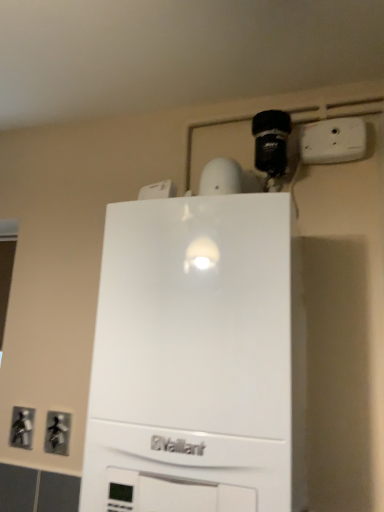
This screenshot has height=512, width=384. Describe the element at coordinates (22, 426) in the screenshot. I see `metallic silver outlet at lower left, the 3th electric outlet from the top` at that location.

Find the location of `metallic gray outlet at lower left, which appears as the 2th electric outlet when viewed from the front`. metallic gray outlet at lower left, which appears as the 2th electric outlet when viewed from the front is located at coordinates (57, 433).

From a real-world perspective, who is located higher, white matte vaillant boiler at center or metallic gray outlet at lower left, which is counted as the second electric outlet, starting from the top?

In real-world perspective, white matte vaillant boiler at center is above.

At what (x,y) coordinates should I click in order to perform the action: click on the 2nd electric outlet behind the white matte vaillant boiler at center, counting from the anchor's position. Please return your answer as a coordinate pair (x, y). Looking at the image, I should click on (57, 433).

Choose the correct answer: Is white matte vaillant boiler at center inside metallic gray outlet at lower left, which is counted as the second electric outlet, starting from the top, or outside it?

white matte vaillant boiler at center is located beyond the bounds of metallic gray outlet at lower left, which is counted as the second electric outlet, starting from the top.

From the image's perspective, does white matte vaillant boiler at center appear lower than metallic gray outlet at lower left, which is counted as the second electric outlet, starting from the top?

Incorrect, from the image's perspective, white matte vaillant boiler at center is higher than metallic gray outlet at lower left, which is counted as the second electric outlet, starting from the top.

Would you say metallic silver outlet at lower left, the 3th electric outlet from the right, is a long distance from metallic gray outlet at lower left, acting as the second electric outlet starting from the left?

No, there isn't a large distance between metallic silver outlet at lower left, the 3th electric outlet from the right, and metallic gray outlet at lower left, acting as the second electric outlet starting from the left.

Considering the sizes of metallic silver outlet at lower left, the 3th electric outlet from the right, and metallic gray outlet at lower left, which appears as the 2th electric outlet when viewed from the front, in the image, is metallic silver outlet at lower left, the 3th electric outlet from the right, taller or shorter than metallic gray outlet at lower left, which appears as the 2th electric outlet when viewed from the front,?

Clearly, metallic silver outlet at lower left, the 3th electric outlet from the right, is taller compared to metallic gray outlet at lower left, which appears as the 2th electric outlet when viewed from the front.

Is metallic silver outlet at lower left, the third electric outlet in the front-to-back sequence, positioned before metallic gray outlet at lower left, acting as the second electric outlet starting from the left?

No, it is behind metallic gray outlet at lower left, acting as the second electric outlet starting from the left.

From a real-world perspective, which is physically above, metallic silver outlet at lower left, which is counted as the 1th electric outlet, starting from the bottom, or metallic gray outlet at lower left, arranged as the second electric outlet when ordered from the bottom?

metallic silver outlet at lower left, which is counted as the 1th electric outlet, starting from the bottom, from a real-world perspective.

Does white plastic electric outlet at upper center, arranged as the 1th electric outlet when viewed from the top, have a lesser width compared to metallic gray outlet at lower left, acting as the second electric outlet starting from the left?

In fact, white plastic electric outlet at upper center, arranged as the 1th electric outlet when viewed from the top, might be wider than metallic gray outlet at lower left, acting as the second electric outlet starting from the left.

Is white plastic electric outlet at upper center, the 1th electric outlet positioned from the right, smaller than metallic gray outlet at lower left, marked as the 2th electric outlet in a back-to-front arrangement?

No, white plastic electric outlet at upper center, the 1th electric outlet positioned from the right, is not smaller than metallic gray outlet at lower left, marked as the 2th electric outlet in a back-to-front arrangement.

Considering the positions of point (354, 138) and point (50, 445), is point (354, 138) closer or farther from the camera than point (50, 445)?

Point (354, 138) appears to be closer to the viewer than point (50, 445).

Relative to metallic gray outlet at lower left, which is counted as the second electric outlet, starting from the right, is white plastic electric outlet at upper center, which is counted as the 3th electric outlet, starting from the back, in front or behind?

white plastic electric outlet at upper center, which is counted as the 3th electric outlet, starting from the back, is positioned closer to the viewer than metallic gray outlet at lower left, which is counted as the second electric outlet, starting from the right.

Relative to white plastic electric outlet at upper center, the third electric outlet when ordered from left to right, is metallic silver outlet at lower left, positioned as the first electric outlet in left-to-right order, in front or behind?

Visually, metallic silver outlet at lower left, positioned as the first electric outlet in left-to-right order, is located behind white plastic electric outlet at upper center, the third electric outlet when ordered from left to right.

From the metallic silver outlet at lower left, the 3th electric outlet from the right, count 2nd electric outlet to the right and point to it. Please provide its 2D coordinates.

[(333, 141)]

From the image's perspective, between metallic silver outlet at lower left, the 3th electric outlet from the right, and white plastic electric outlet at upper center, arranged as the 1th electric outlet when viewed from the top, who is located below?

metallic silver outlet at lower left, the 3th electric outlet from the right, from the image's perspective.

Are metallic silver outlet at lower left, the 3th electric outlet from the right, and white plastic electric outlet at upper center, which ranks as the third electric outlet in bottom-to-top order, located far from each other?

Yes.

Is metallic gray outlet at lower left, which is counted as the second electric outlet, starting from the top, far away from white plastic electric outlet at upper center, the 1th electric outlet positioned from the right?

Yes.

In the scene shown: Who is bigger, metallic gray outlet at lower left, marked as the 2th electric outlet in a back-to-front arrangement, or white plastic electric outlet at upper center, the third electric outlet when ordered from left to right?

Bigger between the two is white plastic electric outlet at upper center, the third electric outlet when ordered from left to right.

Considering the sizes of metallic gray outlet at lower left, arranged as the second electric outlet when ordered from the bottom, and white plastic electric outlet at upper center, the third electric outlet when ordered from left to right, in the image, is metallic gray outlet at lower left, arranged as the second electric outlet when ordered from the bottom, taller or shorter than white plastic electric outlet at upper center, the third electric outlet when ordered from left to right,?

In the image, metallic gray outlet at lower left, arranged as the second electric outlet when ordered from the bottom, appears to be taller than white plastic electric outlet at upper center, the third electric outlet when ordered from left to right.

Image resolution: width=384 pixels, height=512 pixels. What are the coordinates of `the 2nd electric outlet positioned below the white plastic electric outlet at upper center, arranged as the 1th electric outlet when viewed from the top (from a real-world perspective)` in the screenshot? It's located at pos(57,433).

In terms of width, does white plastic electric outlet at upper center, which is counted as the 3th electric outlet, starting from the back, look wider or thinner when compared to metallic silver outlet at lower left, the 3th electric outlet from the top?

white plastic electric outlet at upper center, which is counted as the 3th electric outlet, starting from the back, is wider than metallic silver outlet at lower left, the 3th electric outlet from the top.

From a real-world perspective, is white plastic electric outlet at upper center, which is counted as the 3th electric outlet, starting from the back, physically located above or below metallic silver outlet at lower left, the third electric outlet in the front-to-back sequence?

Clearly, from a real-world perspective, white plastic electric outlet at upper center, which is counted as the 3th electric outlet, starting from the back, is above metallic silver outlet at lower left, the third electric outlet in the front-to-back sequence.

Does point (364, 146) appear closer or farther from the camera than point (24, 446)?

Point (364, 146) is closer to the camera than point (24, 446).

Is white plastic electric outlet at upper center, the 1th electric outlet positioned from the right, spatially inside metallic silver outlet at lower left, the third electric outlet in the front-to-back sequence, or outside of it?

white plastic electric outlet at upper center, the 1th electric outlet positioned from the right, is spatially situated outside metallic silver outlet at lower left, the third electric outlet in the front-to-back sequence.

Can we say white matte vaillant boiler at center lies outside metallic silver outlet at lower left, acting as the 1th electric outlet starting from the back?

Absolutely, white matte vaillant boiler at center is external to metallic silver outlet at lower left, acting as the 1th electric outlet starting from the back.

From a real-world perspective, is white matte vaillant boiler at center positioned under metallic silver outlet at lower left, the 3th electric outlet from the right, based on gravity?

No, from a real-world perspective, white matte vaillant boiler at center is not beneath metallic silver outlet at lower left, the 3th electric outlet from the right.

Measure the distance between white matte vaillant boiler at center and metallic silver outlet at lower left, which is counted as the 1th electric outlet, starting from the bottom.

The distance of white matte vaillant boiler at center from metallic silver outlet at lower left, which is counted as the 1th electric outlet, starting from the bottom, is 71.09 centimeters.

At what (x,y) coordinates should I click in order to perform the action: click on the 3rd electric outlet behind when counting from the white matte vaillant boiler at center. Please return your answer as a coordinate pair (x, y). The image size is (384, 512). Looking at the image, I should click on (22, 426).

Find the location of a particular element. The height and width of the screenshot is (512, 384). the 2nd electric outlet directly beneath the white matte vaillant boiler at center (from a real-world perspective) is located at coordinates (57, 433).

Starting from the metallic silver outlet at lower left, the 3th electric outlet from the right, which electric outlet is the 1st one in front? Please provide its 2D coordinates.

[(57, 433)]

Estimate the real-world distances between objects in this image. Which object is closer to white plastic electric outlet at upper center, arranged as the 1th electric outlet when viewed from the top, metallic gray outlet at lower left, which is counted as the second electric outlet, starting from the right, or white matte vaillant boiler at center?

Among the two, white matte vaillant boiler at center is located nearer to white plastic electric outlet at upper center, arranged as the 1th electric outlet when viewed from the top.

Estimate the real-world distances between objects in this image. Which object is further from metallic silver outlet at lower left, the 3th electric outlet from the right, white plastic electric outlet at upper center, which ranks as the third electric outlet in bottom-to-top order, or white matte vaillant boiler at center?

white plastic electric outlet at upper center, which ranks as the third electric outlet in bottom-to-top order.

Considering their positions, is white plastic electric outlet at upper center, arranged as the 1th electric outlet when viewed from the top, positioned closer to metallic silver outlet at lower left, which is counted as the 1th electric outlet, starting from the bottom, than metallic gray outlet at lower left, marked as the 2th electric outlet in a back-to-front arrangement?

metallic gray outlet at lower left, marked as the 2th electric outlet in a back-to-front arrangement, is positioned closer to the anchor metallic silver outlet at lower left, which is counted as the 1th electric outlet, starting from the bottom.

Which object lies nearer to the anchor point white matte vaillant boiler at center, metallic silver outlet at lower left, the 3th electric outlet from the top, or metallic gray outlet at lower left, which is counted as the second electric outlet, starting from the right?

metallic gray outlet at lower left, which is counted as the second electric outlet, starting from the right, is closer to white matte vaillant boiler at center.

From the image, which object appears to be nearer to metallic gray outlet at lower left, acting as the second electric outlet starting from the left, white matte vaillant boiler at center or white plastic electric outlet at upper center, the first electric outlet positioned from the front?

Based on the image, white matte vaillant boiler at center appears to be nearer to metallic gray outlet at lower left, acting as the second electric outlet starting from the left.

Based on their spatial positions, is metallic silver outlet at lower left, positioned as the first electric outlet in left-to-right order, or metallic gray outlet at lower left, acting as the second electric outlet starting from the left, closer to white plastic electric outlet at upper center, which is counted as the 3th electric outlet, starting from the back?

Based on the image, metallic gray outlet at lower left, acting as the second electric outlet starting from the left, appears to be nearer to white plastic electric outlet at upper center, which is counted as the 3th electric outlet, starting from the back.

When comparing their distances from white matte vaillant boiler at center, does metallic gray outlet at lower left, marked as the 2th electric outlet in a back-to-front arrangement, or metallic silver outlet at lower left, positioned as the first electric outlet in left-to-right order, seem closer?

metallic gray outlet at lower left, marked as the 2th electric outlet in a back-to-front arrangement, lies closer to white matte vaillant boiler at center than the other object.

Based on their spatial positions, is metallic silver outlet at lower left, the 3th electric outlet from the right, or white matte vaillant boiler at center further from white plastic electric outlet at upper center, the third electric outlet when ordered from left to right?

Based on the image, metallic silver outlet at lower left, the 3th electric outlet from the right, appears to be further to white plastic electric outlet at upper center, the third electric outlet when ordered from left to right.

The height and width of the screenshot is (512, 384). I want to click on home appliance between white plastic electric outlet at upper center, the first electric outlet positioned from the front, and metallic gray outlet at lower left, which appears as the 2th electric outlet when viewed from the front, in the vertical direction, so click(x=198, y=359).

Locate an element on the screen. home appliance between metallic silver outlet at lower left, the 3th electric outlet from the top, and white plastic electric outlet at upper center, the third electric outlet when ordered from left to right, in the horizontal direction is located at coordinates point(198,359).

Where is `electric outlet situated between metallic silver outlet at lower left, which is counted as the 1th electric outlet, starting from the bottom, and white plastic electric outlet at upper center, arranged as the 1th electric outlet when viewed from the top, from left to right`? electric outlet situated between metallic silver outlet at lower left, which is counted as the 1th electric outlet, starting from the bottom, and white plastic electric outlet at upper center, arranged as the 1th electric outlet when viewed from the top, from left to right is located at coordinates (57, 433).